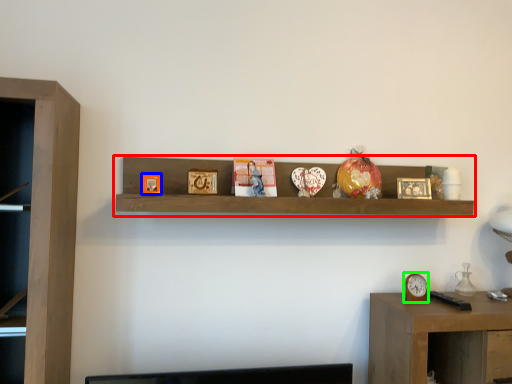
Question: Estimate the real-world distances between objects in this image. Which object is closer to shelf (highlighted by a red box), picture frame (highlighted by a blue box) or clock (highlighted by a green box)?

Choices:
 (A) picture frame
 (B) clock

Answer: (A)